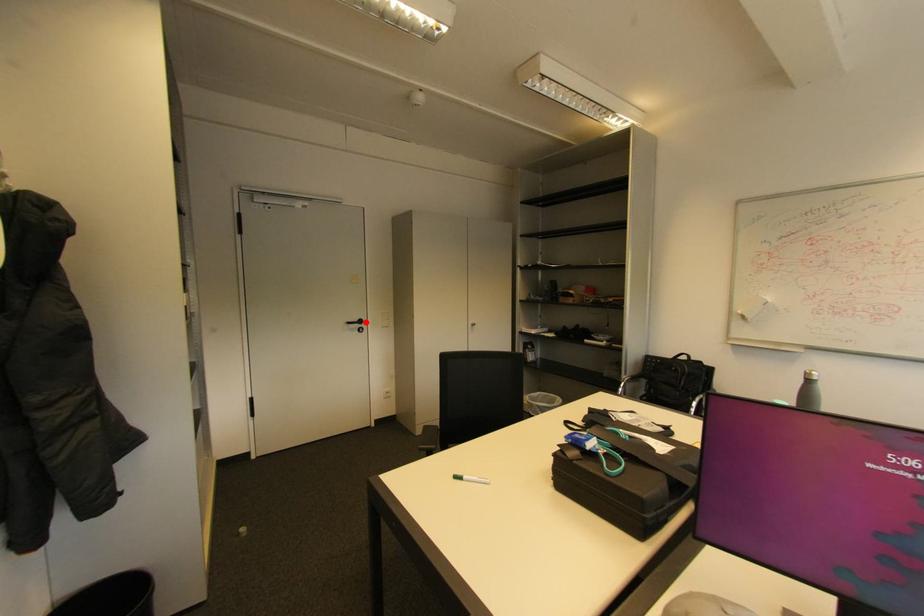
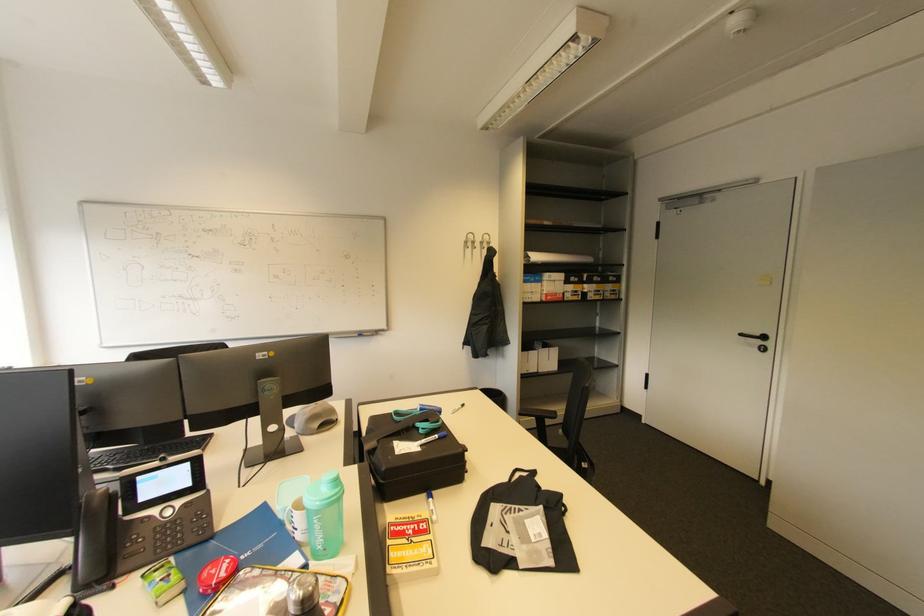
Locate, in the second image, the point that corresponds to the highlighted location in the first image.

(769, 339)